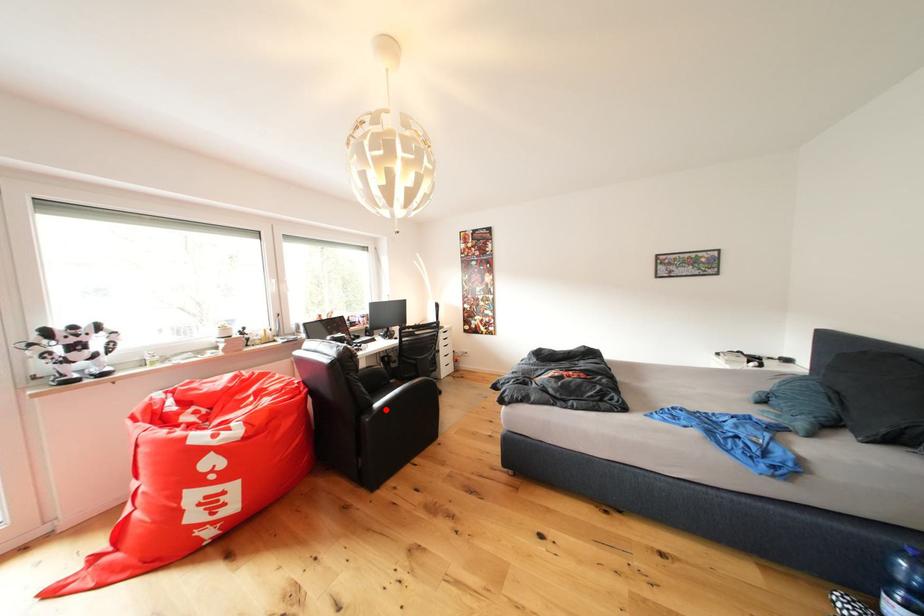
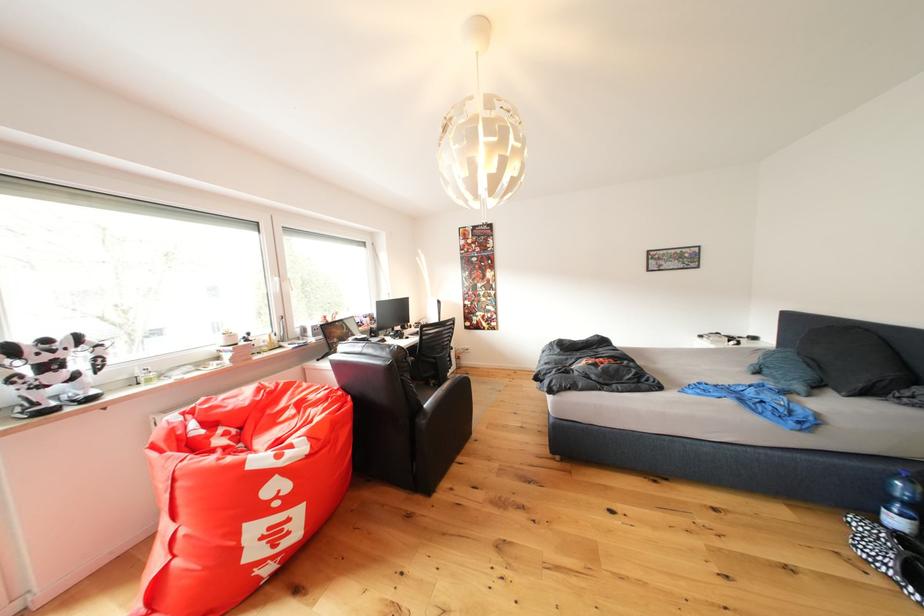
Where in the second image is the point corresponding to the highlighted location from the first image?

(434, 410)